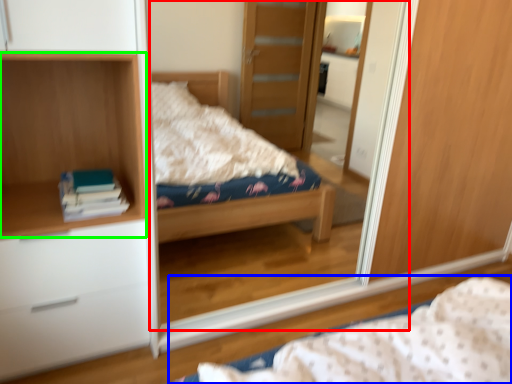
Question: Which is farther away from mirror (highlighted by a red box)? bed (highlighted by a blue box) or cabinet (highlighted by a green box)?

Choices:
 (A) bed
 (B) cabinet

Answer: (A)